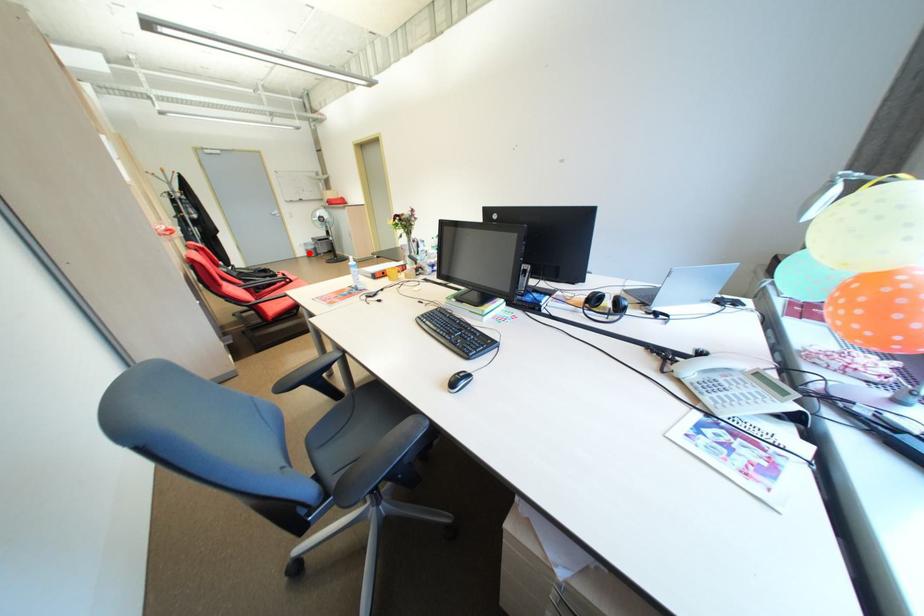
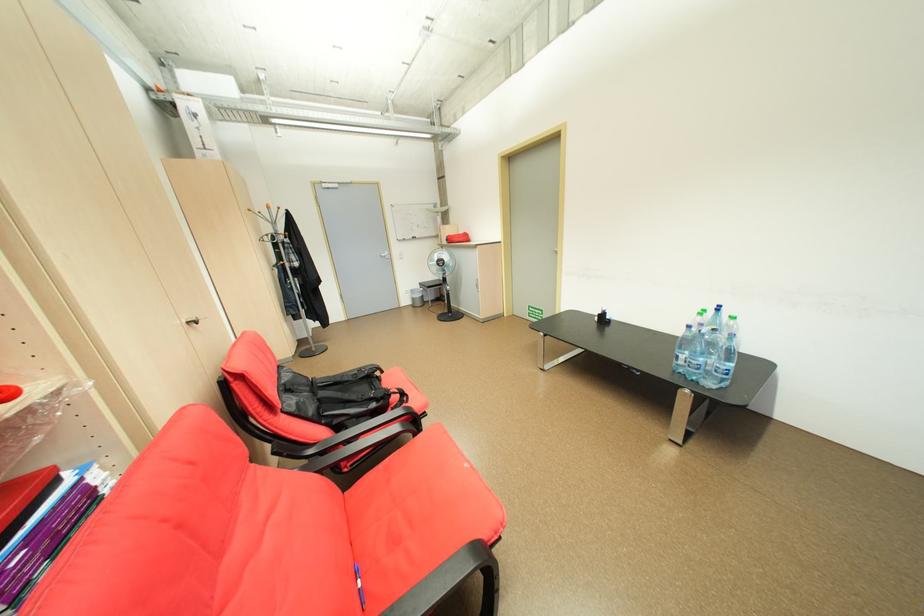
Question: A red point is marked in image1. In image2, is the corresponding 3D point closer to the camera or farther? Reply with the corresponding letter.

Choices:
 (A) The corresponding 3D point is closer.
 (B) The corresponding 3D point is farther.

Answer: (A)